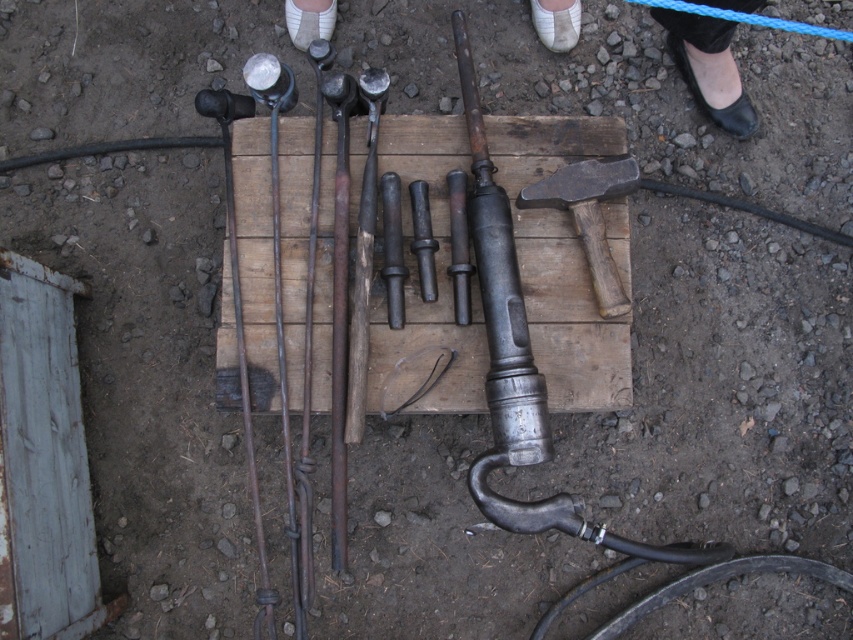
You are a blacksmith who just finished a project and need to put your tools away. You have a white leather shoe at upper center and a dark gray wooden hammer at center. Which tool should you place first if you want to start with the one that is higher up?

You should place the white leather shoe at upper center first because it is located above the dark gray wooden hammer at center.

From the picture: You are a blacksmith who needs to reach the dark gray wooden hammer at center to hit a hot iron. However, the white leather shoe at upper center is blocking your path. Can you move the shoe to access the hammer?

The dark gray wooden hammer at center is behind the white leather shoe at upper center, so you can move the shoe to access the hammer.